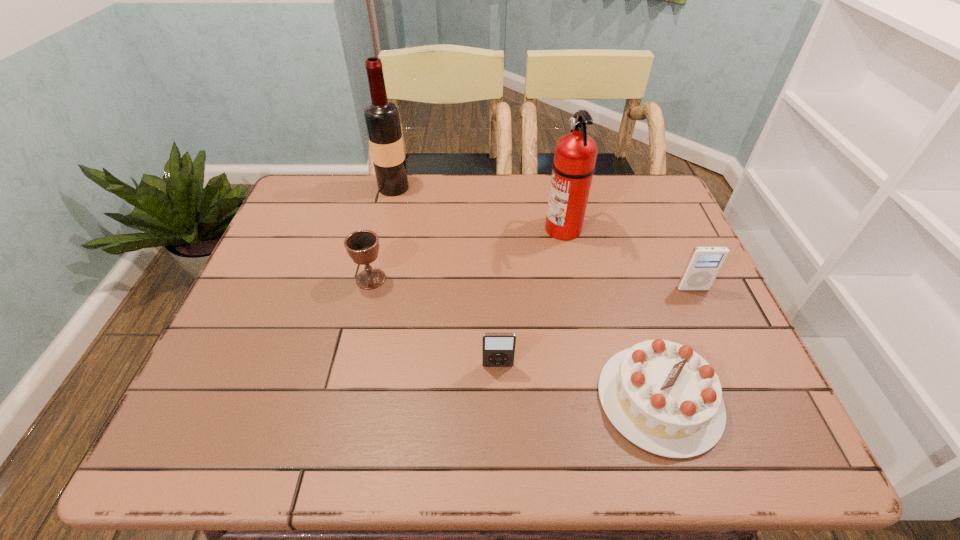
Identify the location of free location that satisfies the following two spatial constraints: 1. at the nozzle of the fifth nearest object; 2. on the front-facing side of the left iPod. The image size is (960, 540). click(590, 366).